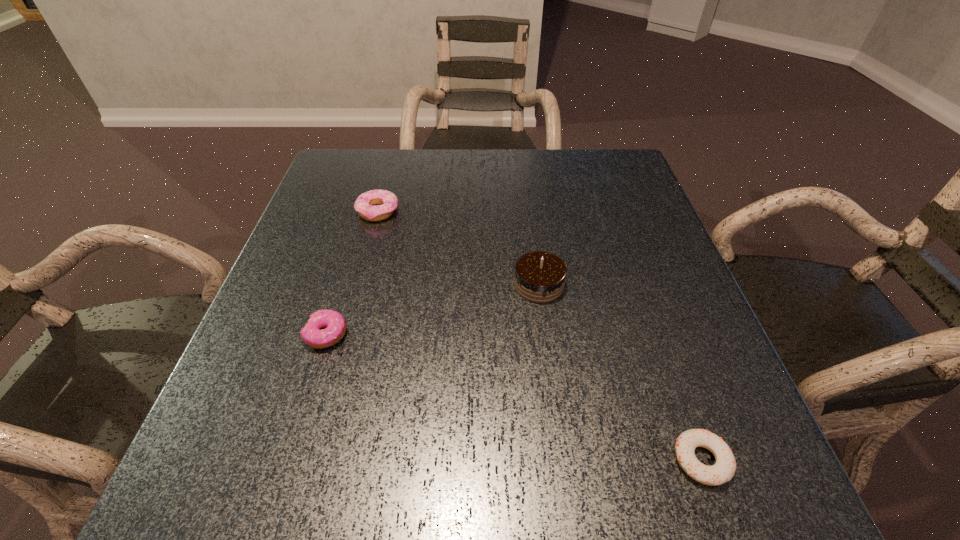
The width and height of the screenshot is (960, 540). Find the location of `blank region between the farthest object and the chocolate cake`. blank region between the farthest object and the chocolate cake is located at coordinates (458, 248).

The height and width of the screenshot is (540, 960). I want to click on free space between the second nearest doughnut and the farthest object, so click(352, 273).

Find the location of `free space between the second farthest object and the second nearest object`. free space between the second farthest object and the second nearest object is located at coordinates (433, 309).

Locate an element on the screen. free space between the shortest doughnut and the farthest object is located at coordinates (540, 336).

Where is `empty space that is in between the second object from right to left and the farthest doughnut`? This screenshot has width=960, height=540. empty space that is in between the second object from right to left and the farthest doughnut is located at coordinates (458, 248).

Where is `vacant region between the farthest object and the nearest object`? The height and width of the screenshot is (540, 960). vacant region between the farthest object and the nearest object is located at coordinates (540, 336).

Where is `free space between the third farthest object and the rightmost object`? The width and height of the screenshot is (960, 540). free space between the third farthest object and the rightmost object is located at coordinates coord(515,397).

Identify the location of unoccupied position between the nearest doughnut and the farthest object. This screenshot has width=960, height=540. (540, 336).

You are a GUI agent. You are given a task and a screenshot of the screen. Output one action in this format:
    pyautogui.click(x=<x>, y=<y>)
    Task: Click on the free space between the tallest object and the farthest object
    This screenshot has height=540, width=960.
    Given the screenshot: What is the action you would take?
    pyautogui.click(x=458, y=248)

At what (x,y) coordinates should I click in order to perform the action: click on vacant space that's between the tallest object and the second nearest doughnut. Please return your answer as a coordinate pair (x, y). This screenshot has width=960, height=540. Looking at the image, I should click on click(x=433, y=309).